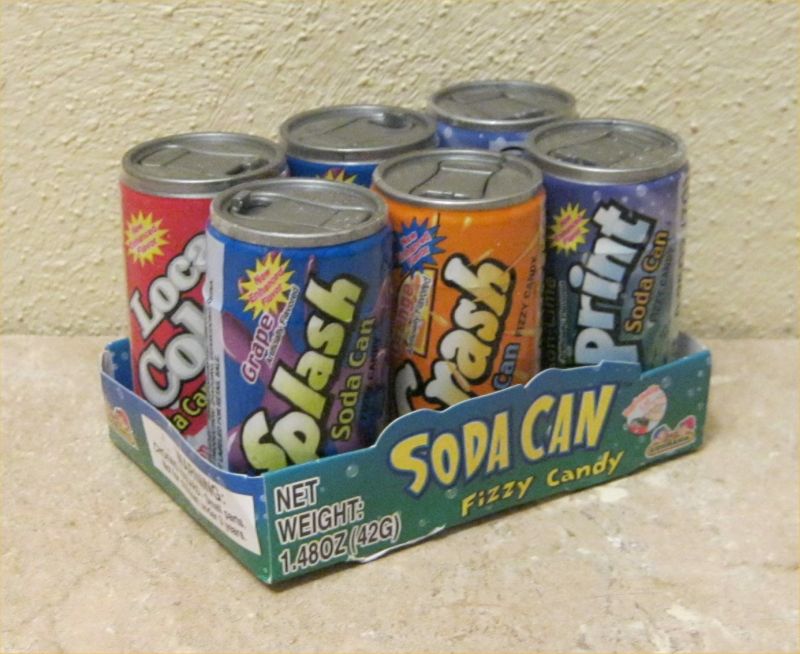
Identify the location of center panel. This screenshot has width=800, height=654. (318, 191).